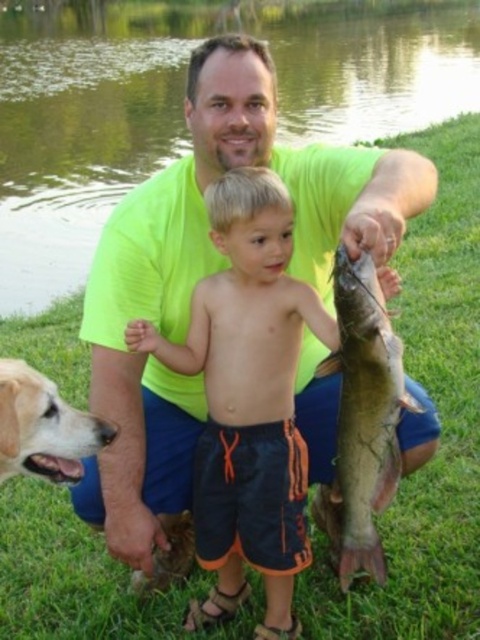
Question: Does neon yellow t-shirt at center appear under orange swim trunks at center?

Choices:
 (A) no
 (B) yes

Answer: (A)

Question: Is shiny silver fish at center below golden fur dog at lower left?

Choices:
 (A) yes
 (B) no

Answer: (A)

Question: Which of the following is the farthest from the observer?

Choices:
 (A) (275, 291)
 (B) (194, 380)
 (C) (48, 426)

Answer: (B)

Question: Which of the following is the farthest from the observer?

Choices:
 (A) pyautogui.click(x=382, y=300)
 (B) pyautogui.click(x=166, y=6)
 (C) pyautogui.click(x=84, y=426)
 (D) pyautogui.click(x=247, y=224)

Answer: (B)

Question: Which object appears closest to the camera in this image?

Choices:
 (A) golden fur dog at lower left
 (B) neon yellow t-shirt at center

Answer: (B)

Question: Can you confirm if orange swim trunks at center is wider than shiny silver fish at center?

Choices:
 (A) yes
 (B) no

Answer: (A)